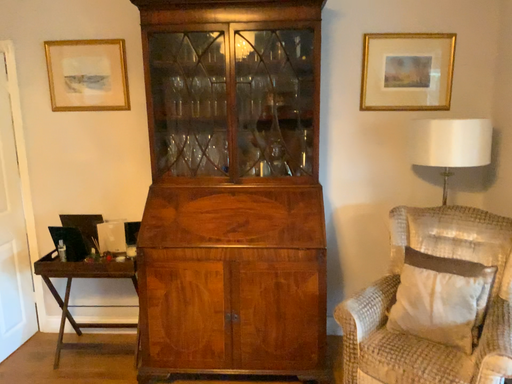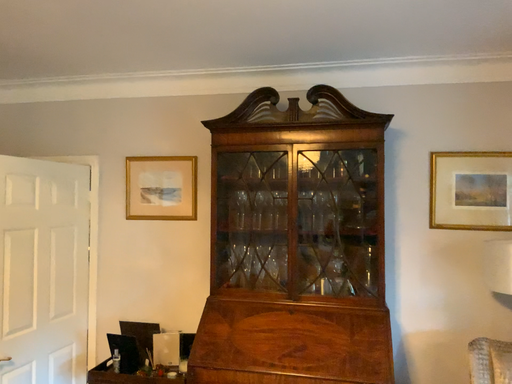
Question: Which way did the camera rotate in the video?

Choices:
 (A) rotated downward
 (B) rotated upward

Answer: (B)